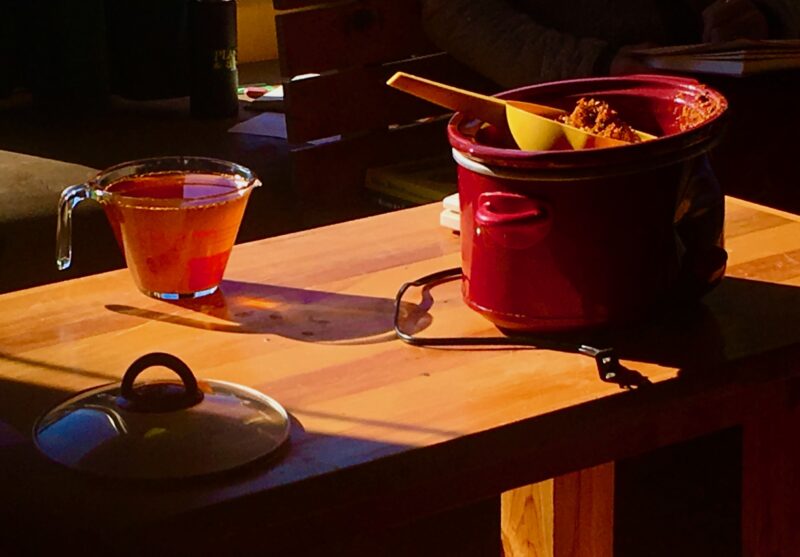
Where is `book`? The image size is (800, 557). book is located at coordinates (410, 185).